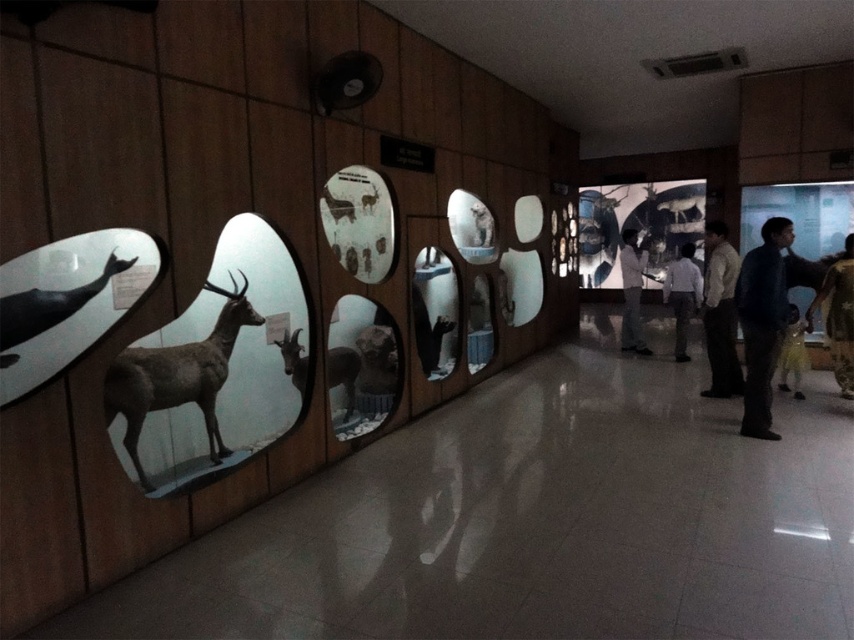
Question: Which object is closer to the camera taking this photo?

Choices:
 (A) matte brown deer at center
 (B) smooth gray rock at center

Answer: (A)

Question: Which point appears closest to the camera in this image?

Choices:
 (A) (781, 385)
 (B) (712, 358)

Answer: (B)

Question: Which object is the closest to the light blue shirt at center?

Choices:
 (A) yellow fur coat at right
 (B) shiny metallic skull at center
 (C) matte black whale at left

Answer: (B)

Question: Is light brown matte deer at center further to camera compared to yellow fur coat at right?

Choices:
 (A) no
 (B) yes

Answer: (A)

Question: Can you confirm if light blue shirt at center is smaller than smooth gray rock at center?

Choices:
 (A) no
 (B) yes

Answer: (A)

Question: Does dark blue shirt at right appear on the right side of shiny metallic skull at center?

Choices:
 (A) no
 (B) yes

Answer: (B)